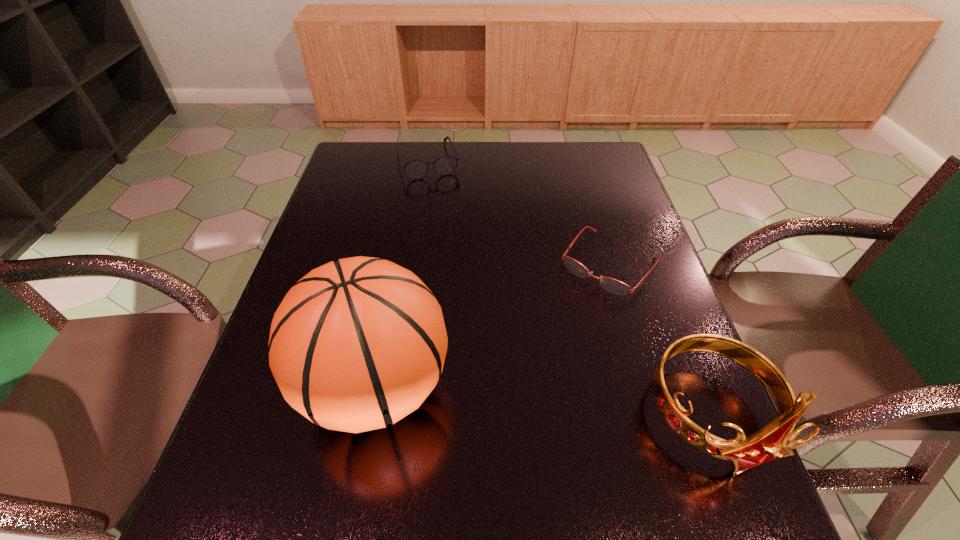
At what (x,y) coordinates should I click in order to perform the action: click on vacant spot on the desktop that is between the basketball and the tiara and is positioned on the lenses of the shortest object. Please return your answer as a coordinate pair (x, y). Looking at the image, I should click on (501, 398).

In order to click on vacant spot on the desktop that is between the basketball and the tiara and is positioned on the front-facing side of the farthest object in this screenshot , I will do `click(514, 400)`.